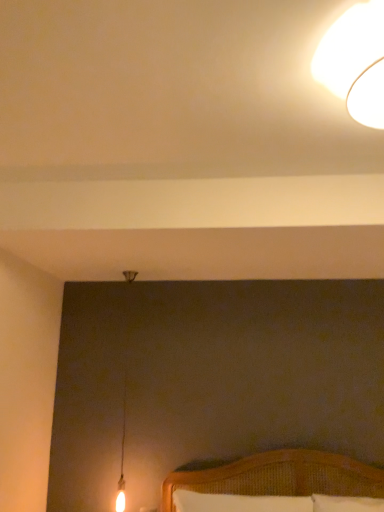
Question: Do you think white glossy lampshade at upper right is within white woven pillow at lower center, or outside of it?

Choices:
 (A) outside
 (B) inside

Answer: (A)

Question: Considering the positions of white glossy lampshade at upper right and white woven pillow at lower center in the image, is white glossy lampshade at upper right bigger or smaller than white woven pillow at lower center?

Choices:
 (A) big
 (B) small

Answer: (B)

Question: Considering the positions of point (x=369, y=79) and point (x=211, y=503), is point (x=369, y=79) closer or farther from the camera than point (x=211, y=503)?

Choices:
 (A) farther
 (B) closer

Answer: (B)

Question: Is white woven pillow at lower center in front of or behind white glossy lampshade at upper right in the image?

Choices:
 (A) front
 (B) behind

Answer: (B)

Question: Is point (296, 501) closer or farther from the camera than point (365, 103)?

Choices:
 (A) closer
 (B) farther

Answer: (B)

Question: Would you say white woven pillow at lower center is to the left or to the right of white glossy lampshade at upper right in the picture?

Choices:
 (A) left
 (B) right

Answer: (A)

Question: In terms of width, does white woven pillow at lower center look wider or thinner when compared to white glossy lampshade at upper right?

Choices:
 (A) wide
 (B) thin

Answer: (B)